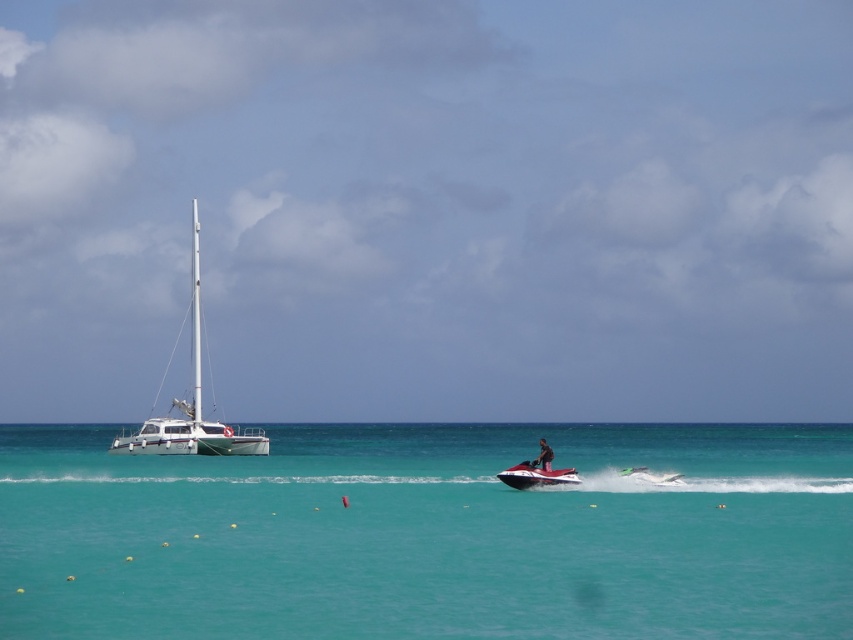
You are a photographer planning to take a photo of the dark skin human at center and the white glossy sailboat at left. Which object should you place closer to the left edge of your camera frame?

The white glossy sailboat at left should be placed closer to the left edge of your camera frame because it is positioned on the left side of the dark skin human at center.

You are a drone operator who needs to capture an aerial shot of the turquoise glossy water at center. The drone is currently at point (428,534). What should you do next to get the best shot?

The point (428,534) is where the turquoise glossy water at center is located. To capture the best shot, the drone should hover at that point and adjust the camera angle to focus on the reflective surface of the turquoise glossy water at center.